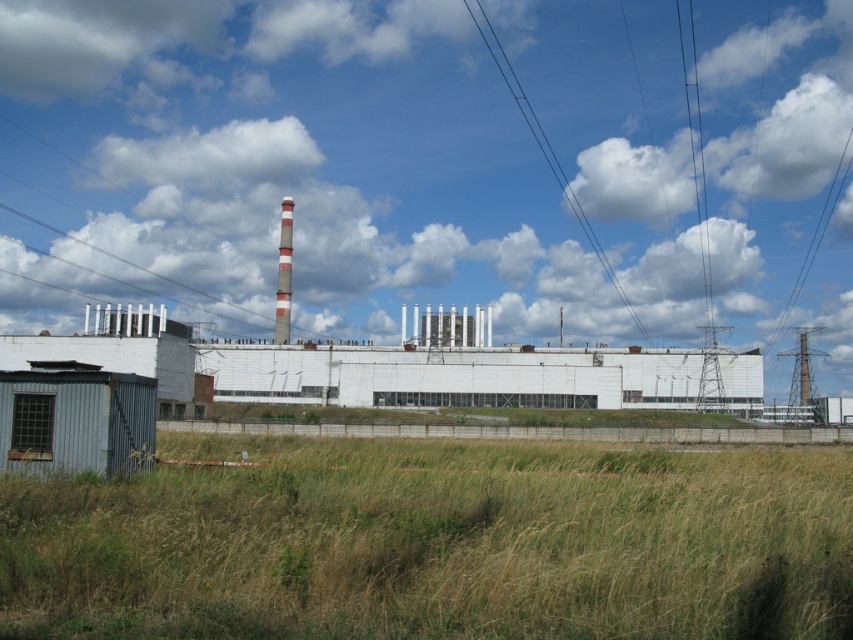
Question: Estimate the real-world distances between objects in this image. Which object is farther from the white fluffy cloud at upper center?

Choices:
 (A) green grass at lower left
 (B) white striped chimney at center
 (C) white fluffy cloud at upper left
 (D) black wire at upper center

Answer: (A)

Question: Is black wire at upper center below white striped chimney at center?

Choices:
 (A) no
 (B) yes

Answer: (A)

Question: Considering the relative positions of white fluffy cloud at upper center and green grass at lower left in the image provided, where is white fluffy cloud at upper center located with respect to green grass at lower left?

Choices:
 (A) above
 (B) below

Answer: (A)

Question: Estimate the real-world distances between objects in this image. Which object is closer to the white fluffy cloud at upper left?

Choices:
 (A) white fluffy cloud at upper center
 (B) white striped chimney at center

Answer: (A)

Question: Can you confirm if white fluffy cloud at upper center is thinner than green grass at lower left?

Choices:
 (A) no
 (B) yes

Answer: (A)

Question: Which point is closer to the camera?

Choices:
 (A) black wire at upper center
 (B) white striped chimney at center

Answer: (B)